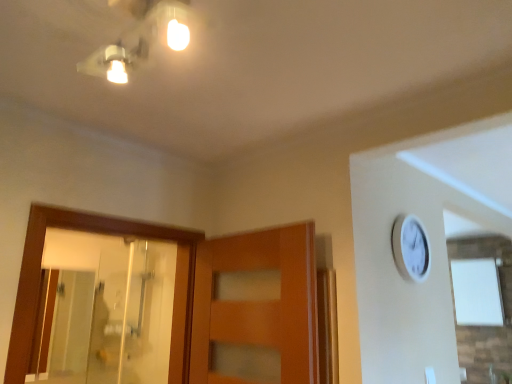
Question: Does matte white light fixture at upper center turn towards transparent glass mirror at left?

Choices:
 (A) yes
 (B) no

Answer: (B)

Question: From the image's perspective, is matte white light fixture at upper center on top of transparent glass mirror at left?

Choices:
 (A) no
 (B) yes

Answer: (B)

Question: Does matte white light fixture at upper center have a greater width compared to transparent glass mirror at left?

Choices:
 (A) yes
 (B) no

Answer: (A)

Question: Does matte white light fixture at upper center appear on the right side of transparent glass mirror at left?

Choices:
 (A) no
 (B) yes

Answer: (B)

Question: Is matte white light fixture at upper center positioned in front of transparent glass mirror at left?

Choices:
 (A) yes
 (B) no

Answer: (A)

Question: Considering the relative positions of matte white light fixture at upper center and transparent glass mirror at left in the image provided, is matte white light fixture at upper center behind transparent glass mirror at left?

Choices:
 (A) yes
 (B) no

Answer: (B)

Question: Can you confirm if transparent glass mirror at left is smaller than matte white light fixture at upper center?

Choices:
 (A) yes
 (B) no

Answer: (B)

Question: From a real-world perspective, is transparent glass mirror at left located higher than matte white light fixture at upper center?

Choices:
 (A) yes
 (B) no

Answer: (B)

Question: Considering the relative sizes of transparent glass mirror at left and matte white light fixture at upper center in the image provided, is transparent glass mirror at left wider than matte white light fixture at upper center?

Choices:
 (A) yes
 (B) no

Answer: (B)

Question: Does transparent glass mirror at left lie in front of matte white light fixture at upper center?

Choices:
 (A) no
 (B) yes

Answer: (A)

Question: Does transparent glass mirror at left have a lesser height compared to matte white light fixture at upper center?

Choices:
 (A) no
 (B) yes

Answer: (A)

Question: Is transparent glass mirror at left to the right of matte white light fixture at upper center from the viewer's perspective?

Choices:
 (A) yes
 (B) no

Answer: (B)

Question: Would you say transparent glass mirror at left is to the left or to the right of matte white light fixture at upper center in the picture?

Choices:
 (A) right
 (B) left

Answer: (B)